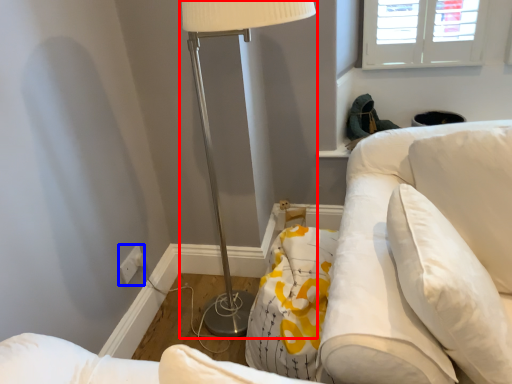
Question: Which object is further to the camera taking this photo, lamp (highlighted by a red box) or electric outlet (highlighted by a blue box)?

Choices:
 (A) lamp
 (B) electric outlet

Answer: (B)